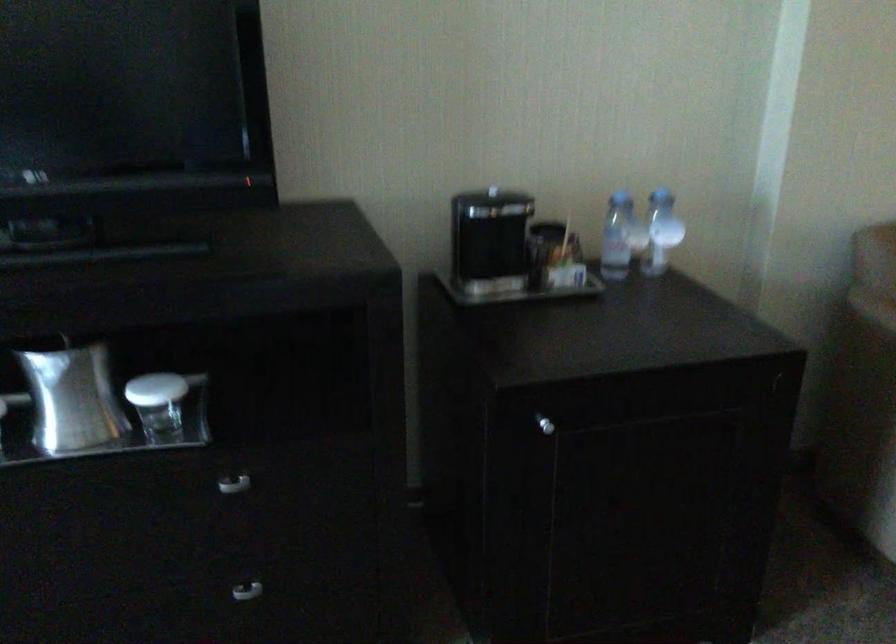
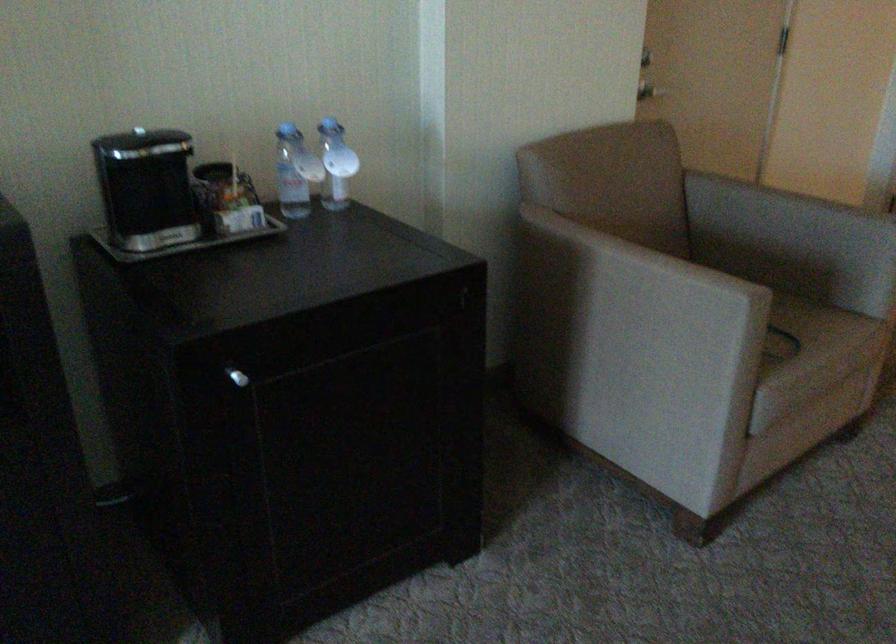
In the second image, find the point that corresponds to [622,234] in the first image.

(295, 172)